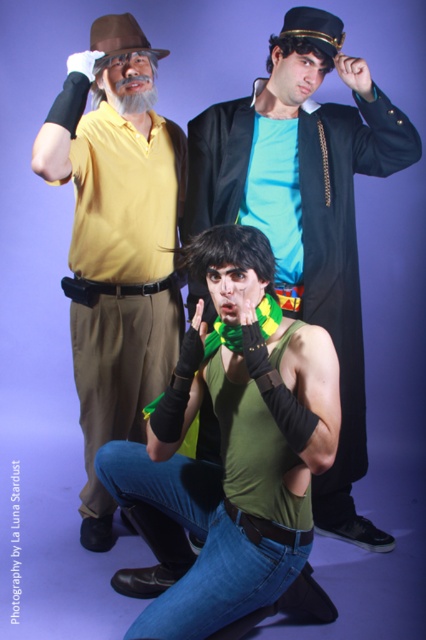
What are the coordinates of the green matte vest at center?

The green matte vest at center is located at coordinates (230, 451).